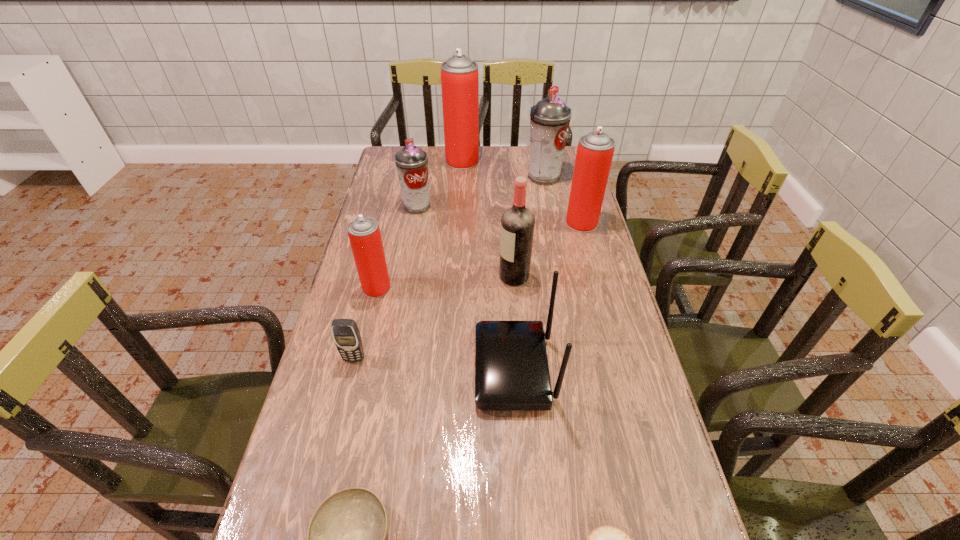
This screenshot has height=540, width=960. In the image, there is a desktop. In order to click on vacant space at the far left corner in this screenshot , I will do `click(383, 170)`.

What are the coordinates of `free space between the smaller gray aerosol can and the liquor` in the screenshot? It's located at (466, 241).

The height and width of the screenshot is (540, 960). I want to click on free space between the eighth tallest object and the nearest red aerosol can, so pos(366,323).

Where is `empty space between the second nearest red aerosol can and the router`? The image size is (960, 540). empty space between the second nearest red aerosol can and the router is located at coordinates (548, 296).

Where is `free space that is in between the second smallest red aerosol can and the router`? This screenshot has width=960, height=540. free space that is in between the second smallest red aerosol can and the router is located at coordinates (548, 296).

The width and height of the screenshot is (960, 540). Find the location of `object that is the fourth nearest to the farther gray aerosol can`. object that is the fourth nearest to the farther gray aerosol can is located at coordinates (517, 223).

Locate an element on the screen. The width and height of the screenshot is (960, 540). object that is the sixth closest to the farthest red aerosol can is located at coordinates (511, 366).

Where is `aerosol can object that ranks as the closest to the nearest aerosol can`? aerosol can object that ranks as the closest to the nearest aerosol can is located at coordinates (411, 161).

Identify the location of aerosol can identified as the fourth closest to the bowl. (549, 119).

Identify which red aerosol can is the second nearest to the cellular telephone. Please provide its 2D coordinates. Your answer should be formatted as a tuple, i.e. [(x, y)], where the tuple contains the x and y coordinates of a point satisfying the conditions above.

[(595, 150)]